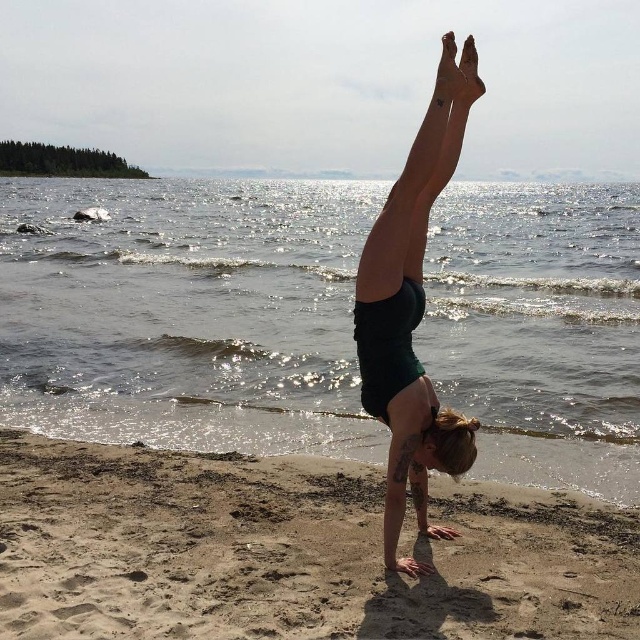
Which is more to the left, glistening water at center or green matte shorts at center?

Positioned to the left is glistening water at center.

Which is in front, point (266, 182) or point (452, 84)?

Point (452, 84) is more forward.

This screenshot has width=640, height=640. In order to click on glistening water at center in this screenshot , I will do [x=186, y=312].

Which of these two, glistening water at center or brown sandy beach at lower center, stands taller?

glistening water at center

Describe the element at coordinates (186, 312) in the screenshot. I see `glistening water at center` at that location.

Measure the distance between glistening water at center and camera.

glistening water at center is 5.89 meters away from camera.

Image resolution: width=640 pixels, height=640 pixels. What are the coordinates of `glistening water at center` in the screenshot? It's located at (186, 312).

Does brown sandy beach at lower center have a lesser width compared to green matte shorts at center?

No.

Does brown sandy beach at lower center have a greater height compared to green matte shorts at center?

No, brown sandy beach at lower center is not taller than green matte shorts at center.

Who is more distant from viewer, (618, 611) or (420, 230)?

Positioned behind is point (420, 230).

Find the location of a particular element. brown sandy beach at lower center is located at coordinates coord(291,552).